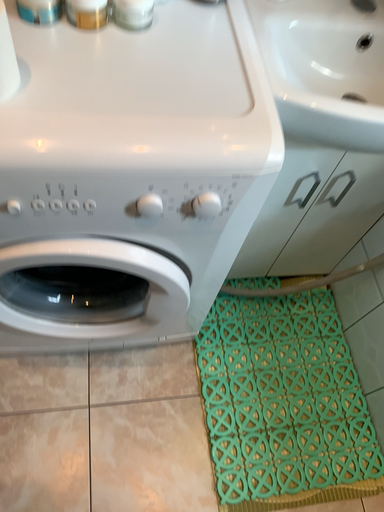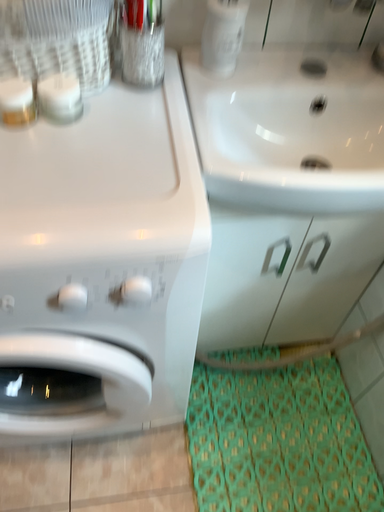
Question: Which way did the camera rotate in the video?

Choices:
 (A) rotated upward
 (B) rotated downward

Answer: (A)